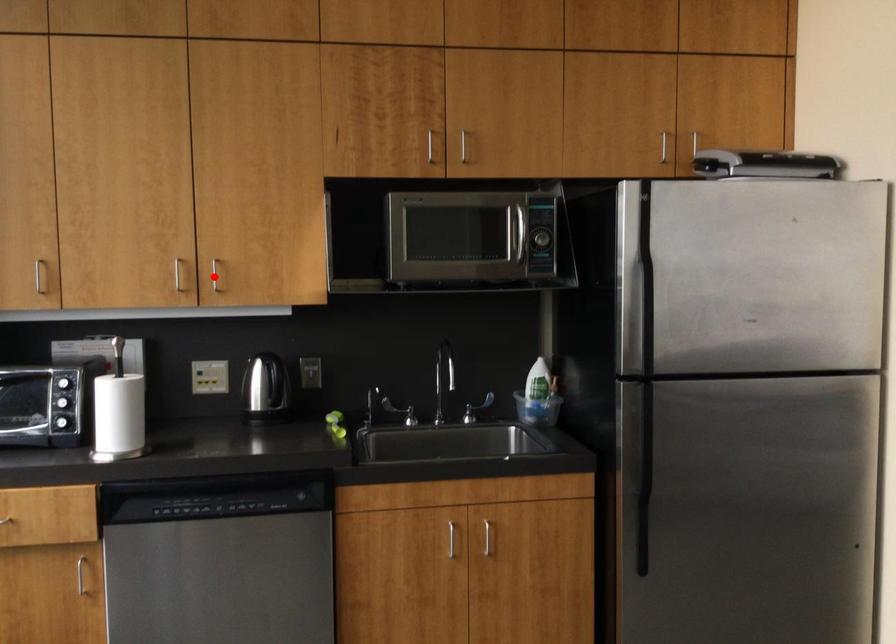
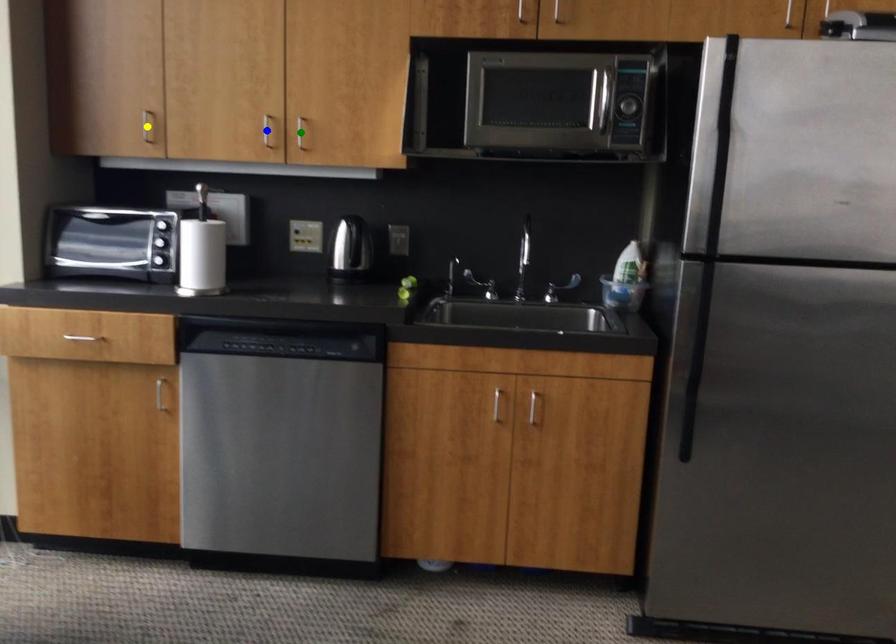
Question: I am providing you with two images of the same scene from different viewpoints. A red point is marked on the first image. You are given multiple points on the second image. Can you choose the point in image 2 that corresponds to the point in image 1?

Choices:
 (A) yellow point
 (B) green point
 (C) blue point

Answer: (B)